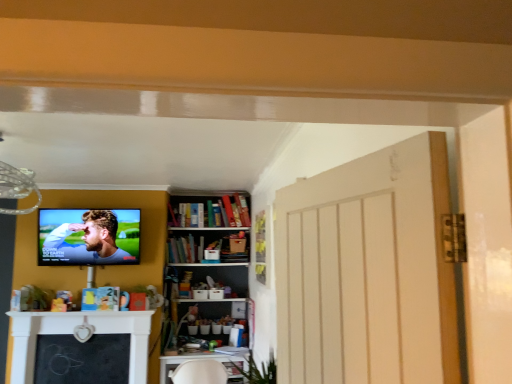
Question: From a real-world perspective, is matte black tv at upper left positioned above or below white plastic table at lower center?

Choices:
 (A) below
 (B) above

Answer: (B)

Question: Is point (94, 215) positioned closer to the camera than point (214, 357)?

Choices:
 (A) closer
 (B) farther

Answer: (B)

Question: Which of these objects is positioned closest to the white plastic table at lower center?

Choices:
 (A) matte black tv at upper left
 (B) hardcover books at center

Answer: (B)

Question: Which is nearer to the white plastic table at lower center?

Choices:
 (A) matte black tv at upper left
 (B) hardcover books at center

Answer: (B)